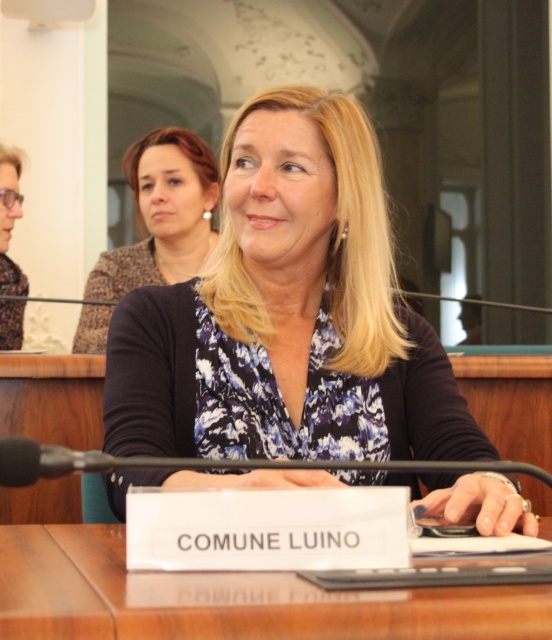
Based on the scene description, which object is taller between the blue floral blouse at center and the wooden table at center?

The blue floral blouse at center is taller than the wooden table at center according to the description.

You are a photographer taking a portrait of the woman in the scene. To ensure the wooden table at center and the blue floral blouse at center are both in focus, which object should you place your camera focus on first?

The wooden table at center is behind the blue floral blouse at center, so you should focus on the wooden table at center first to ensure both are in focus.

You are an event organizer setting up a conference room. You have two items to place on the table in front of the speaker. The items are the matte black blazer at upper center and the matte black glasses at left. Based on their sizes, where should you place the larger item to ensure it doesn

The matte black blazer at upper center is larger in size than the matte black glasses at left, so you should place the matte black blazer at upper center in a position where it won